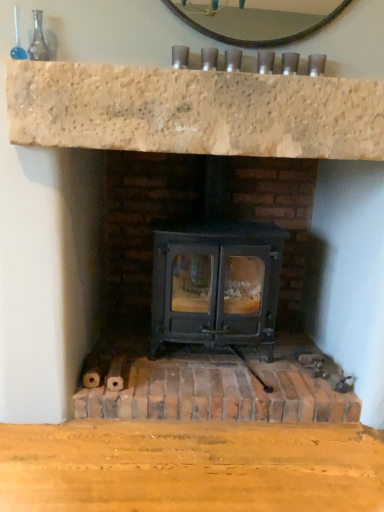
The height and width of the screenshot is (512, 384). What do you see at coordinates (216, 284) in the screenshot?
I see `black metal wood burning stove at center` at bounding box center [216, 284].

Where is `black metal wood burning stove at center`? This screenshot has height=512, width=384. black metal wood burning stove at center is located at coordinates (216, 284).

I want to click on black metal wood burning stove at center, so click(216, 284).